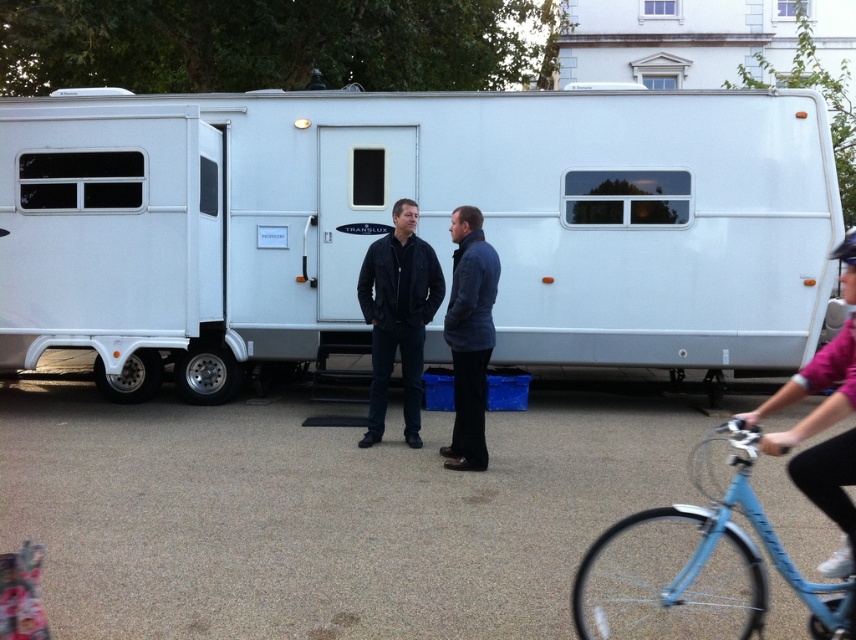
Based on the photo, is black leather jacket at center bigger than dark blue quilted jacket at center?

Indeed, black leather jacket at center has a larger size compared to dark blue quilted jacket at center.

Does point (415, 316) come farther from viewer compared to point (498, 262)?

Yes, it is.

The width and height of the screenshot is (856, 640). What are the coordinates of `black leather jacket at center` in the screenshot? It's located at (397, 316).

Who is more distant from viewer, (598,554) or (803,422)?

The point (598,554) is behind.

Is blue matte bicycle at lower right below pink fabric helmet at upper right?

Yes.

Is point (703, 490) positioned after point (853, 284)?

Yes, point (703, 490) is farther from viewer.

Locate an element on the screen. blue matte bicycle at lower right is located at coordinates (696, 568).

Between pink fabric helmet at upper right and dark blue quilted jacket at center, which one has less height?

Standing shorter between the two is pink fabric helmet at upper right.

Can you confirm if pink fabric helmet at upper right is thinner than dark blue quilted jacket at center?

No, pink fabric helmet at upper right is not thinner than dark blue quilted jacket at center.

The width and height of the screenshot is (856, 640). I want to click on pink fabric helmet at upper right, so click(813, 392).

I want to click on pink fabric helmet at upper right, so click(x=813, y=392).